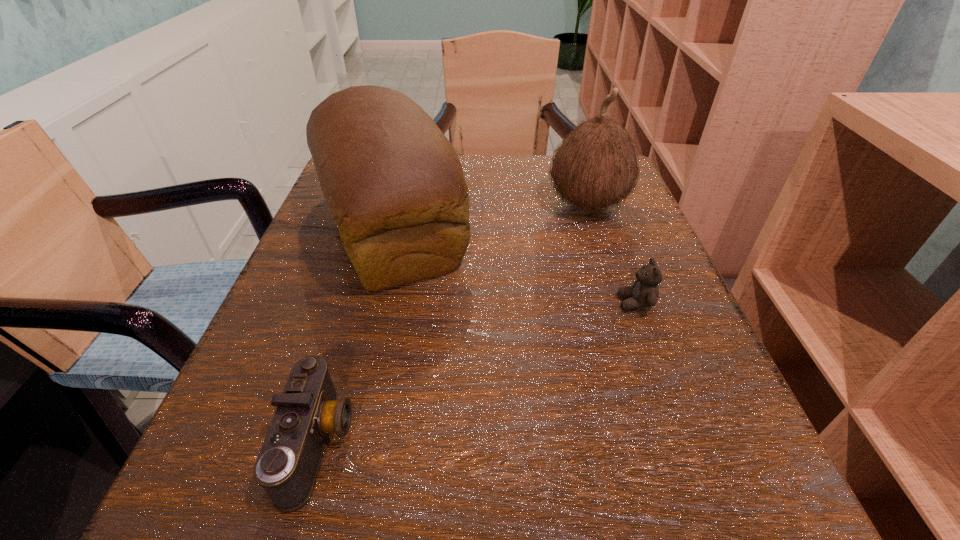
Image resolution: width=960 pixels, height=540 pixels. I want to click on object positioned at the near left corner, so click(x=308, y=410).

Identify the location of object that is at the far right corner. (596, 166).

In the image, there is a desktop. Where is `free space at the far edge`? free space at the far edge is located at coordinates (462, 159).

This screenshot has height=540, width=960. I want to click on free space at the left edge of the desktop, so click(309, 354).

This screenshot has height=540, width=960. I want to click on free space at the right edge of the desktop, so click(638, 427).

Where is `vacant space at the near right corner of the desktop`? Image resolution: width=960 pixels, height=540 pixels. vacant space at the near right corner of the desktop is located at coordinates (721, 528).

Locate an element on the screen. The image size is (960, 540). vacant area between the teddy bear and the coconut is located at coordinates (612, 254).

At what (x,y) coordinates should I click in order to perform the action: click on free space between the teddy bear and the camera. Please return your answer as a coordinate pair (x, y). This screenshot has height=540, width=960. Looking at the image, I should click on (477, 373).

At what (x,y) coordinates should I click in order to perform the action: click on free spot between the coconut and the nearest object. Please return your answer as a coordinate pair (x, y). Looking at the image, I should click on (453, 323).

Where is `free space that is in between the nearest object and the coconut`? free space that is in between the nearest object and the coconut is located at coordinates (453, 323).